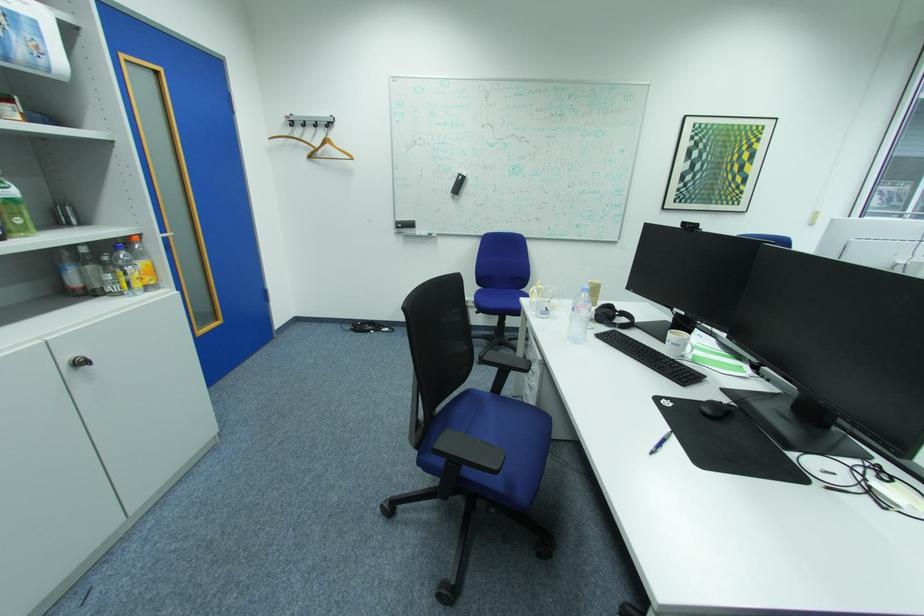
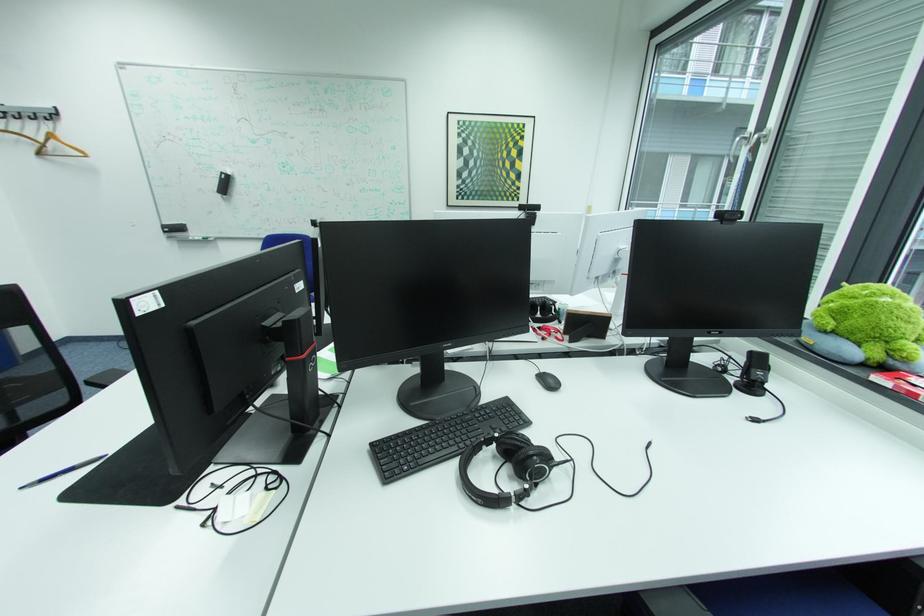
The point at (320, 156) is marked in the first image. Where is the corresponding point in the second image?

(49, 153)